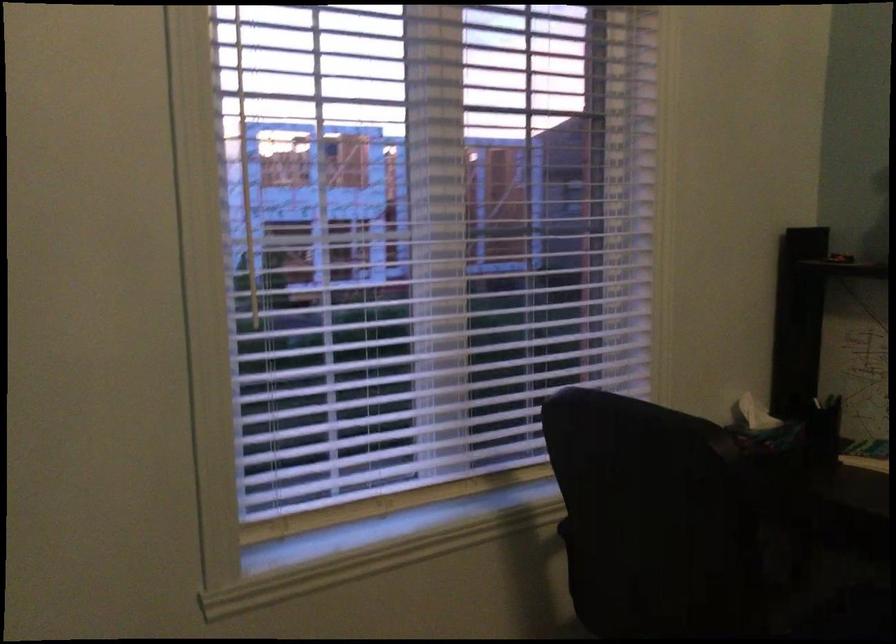
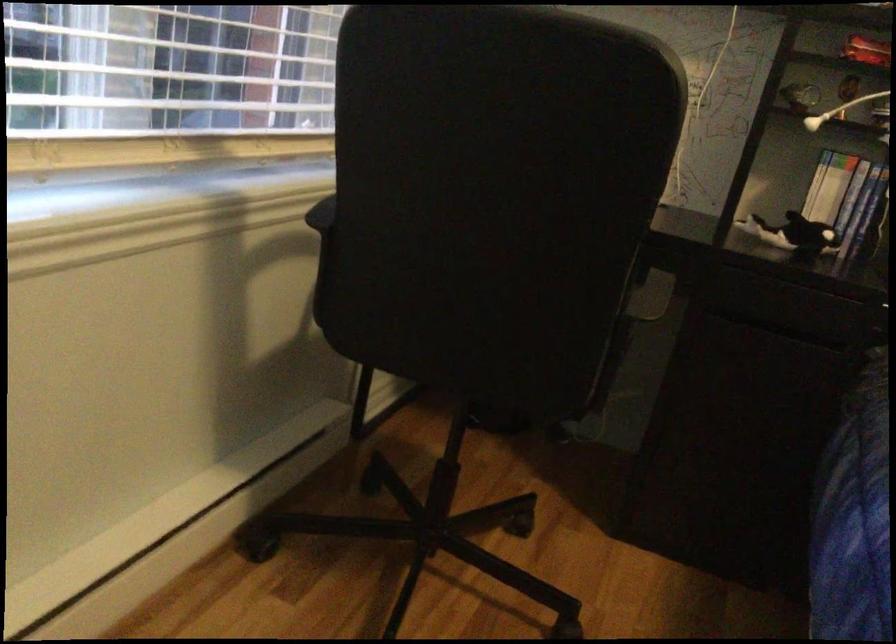
Question: The images are taken continuously from a first-person perspective. In which direction is your viewpoint rotating?

Choices:
 (A) Left
 (B) Right
 (C) Up
 (D) Down

Answer: (B)